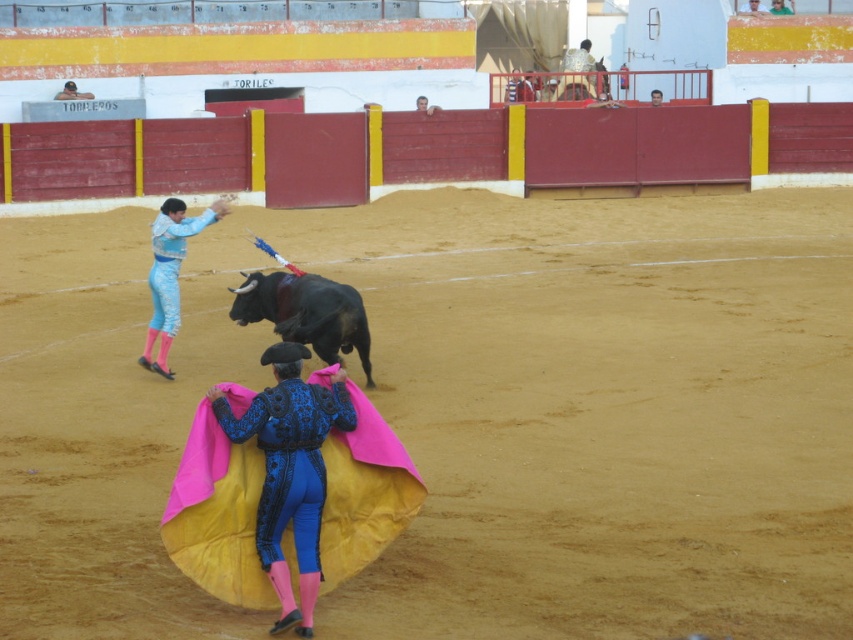
Is point (152, 324) farther from viewer compared to point (73, 93)?

No, it is in front of (73, 93).

How distant is light blue satin suit at left from light blue fabric at upper left?

light blue satin suit at left and light blue fabric at upper left are 65.57 feet apart.

Image resolution: width=853 pixels, height=640 pixels. What are the coordinates of `light blue satin suit at left` in the screenshot? It's located at click(170, 275).

The image size is (853, 640). I want to click on light blue satin suit at left, so pos(170,275).

Is shiny black bull at center to the left of light blue satin suit at left from the viewer's perspective?

In fact, shiny black bull at center is to the right of light blue satin suit at left.

Between shiny black bull at center and light blue satin suit at left, which one is positioned higher?

Positioned higher is light blue satin suit at left.

Identify the location of shiny black bull at center. (306, 314).

Is point (273, 582) positioned after point (780, 8)?

That is False.

The height and width of the screenshot is (640, 853). What do you see at coordinates (289, 468) in the screenshot? I see `blue velvet suit at center` at bounding box center [289, 468].

The height and width of the screenshot is (640, 853). Find the location of `blue velvet suit at center`. blue velvet suit at center is located at coordinates (289, 468).